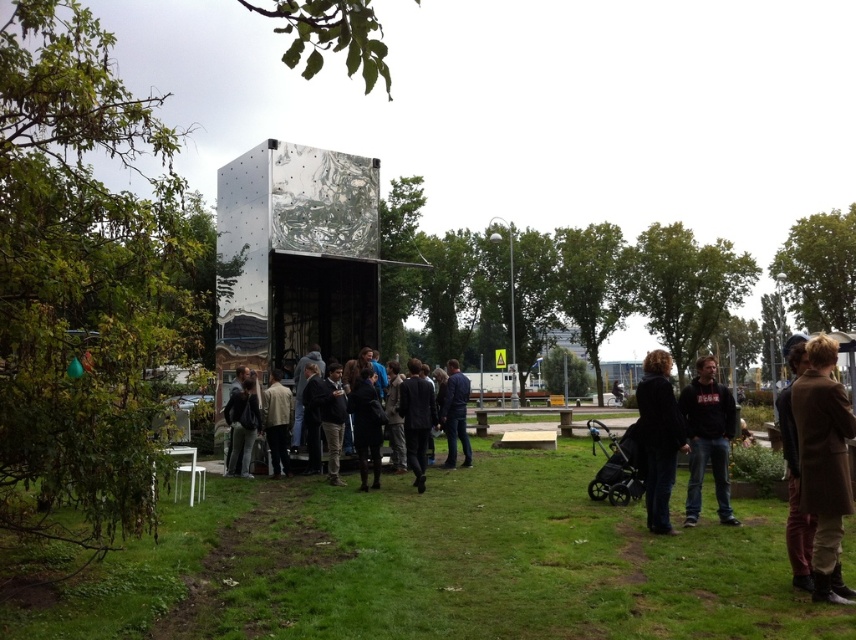
Between brown leather coat at lower right and black fur coat at lower right, which one is positioned lower?

black fur coat at lower right is below.

Is brown leather coat at lower right above black fur coat at lower right?

Correct, brown leather coat at lower right is located above black fur coat at lower right.

This screenshot has height=640, width=856. What do you see at coordinates (824, 465) in the screenshot?
I see `brown leather coat at lower right` at bounding box center [824, 465].

You are a GUI agent. You are given a task and a screenshot of the screen. Output one action in this format:
    pyautogui.click(x=<x>, y=<y>)
    Task: Click on the brown leather coat at lower right
    Image resolution: width=856 pixels, height=640 pixels.
    Given the screenshot: What is the action you would take?
    pyautogui.click(x=824, y=465)

Who is positioned more to the right, dark blue jacket at center or blue denim jacket at center?

blue denim jacket at center is more to the right.

Can you confirm if dark blue jacket at center is taller than blue denim jacket at center?

Incorrect, dark blue jacket at center's height is not larger of blue denim jacket at center's.

Locate an element on the screen. The width and height of the screenshot is (856, 640). dark blue jacket at center is located at coordinates (324, 394).

Can you confirm if black fur coat at lower right is wider than brown wool coat at lower right?

No, black fur coat at lower right is not wider than brown wool coat at lower right.

Can you confirm if black fur coat at lower right is positioned to the right of brown wool coat at lower right?

No, black fur coat at lower right is not to the right of brown wool coat at lower right.

Find the location of `black fur coat at lower right`. black fur coat at lower right is located at coordinates (658, 436).